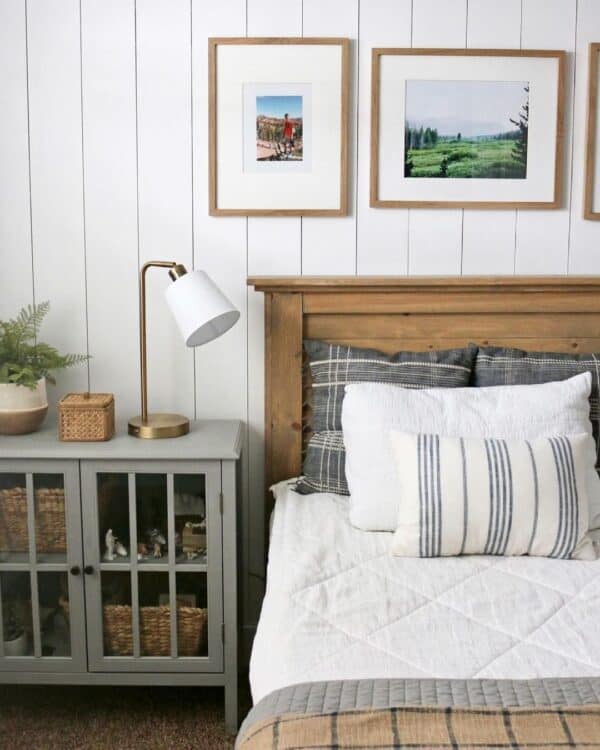
At what (x,y) coordinates should I click in order to perform the action: click on picture frame. Please return your answer as a coordinate pair (x, y). Looking at the image, I should click on (345, 44), (562, 55), (595, 50).